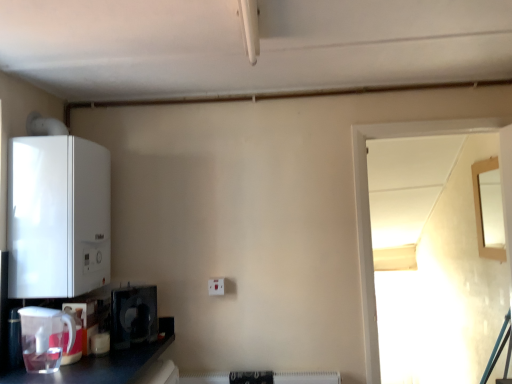
Question: Does white plastic electric outlet at center have a greater height compared to transparent glass door at right, which appears as the second window when viewed from the back?

Choices:
 (A) no
 (B) yes

Answer: (A)

Question: Is white plastic electric outlet at center smaller than transparent glass door at right, which appears as the first window when viewed from the left?

Choices:
 (A) no
 (B) yes

Answer: (B)

Question: Does white plastic electric outlet at center come in front of transparent glass door at right, which appears as the first window when viewed from the left?

Choices:
 (A) yes
 (B) no

Answer: (B)

Question: From the image's perspective, is white plastic electric outlet at center beneath transparent glass door at right, positioned as the 1th window in front-to-back order?

Choices:
 (A) yes
 (B) no

Answer: (A)

Question: Could you tell me if white plastic electric outlet at center is turned towards transparent glass door at right, which appears as the second window when viewed from the back?

Choices:
 (A) no
 (B) yes

Answer: (A)

Question: In the image, is wooden framed mirror at upper right, the 2th window from the left, positioned in front of or behind matte white kettle at lower left, which is the first appliance from bottom to top?

Choices:
 (A) front
 (B) behind

Answer: (B)

Question: Is wooden framed mirror at upper right, the 2th window from the left, situated inside matte white kettle at lower left, the fourth appliance from the top, or outside?

Choices:
 (A) inside
 (B) outside

Answer: (B)

Question: Considering the positions of wooden framed mirror at upper right, the 1th window when ordered from right to left, and matte white kettle at lower left, which is the first appliance from bottom to top, in the image, is wooden framed mirror at upper right, the 1th window when ordered from right to left, bigger or smaller than matte white kettle at lower left, which is the first appliance from bottom to top,?

Choices:
 (A) small
 (B) big

Answer: (B)

Question: From the image's perspective, relative to matte white kettle at lower left, the fourth appliance from the top, is wooden framed mirror at upper right, the 2th window from the left, above or below?

Choices:
 (A) above
 (B) below

Answer: (A)

Question: Considering their positions, is black plastic microwave at lower left, which ranks as the 3th appliance in top-to-bottom order, located in front of or behind transparent glass door at right, which appears as the first window when viewed from the left?

Choices:
 (A) front
 (B) behind

Answer: (A)

Question: Based on their sizes in the image, would you say black plastic microwave at lower left, which ranks as the 3th appliance in top-to-bottom order, is bigger or smaller than transparent glass door at right, which appears as the second window when viewed from the back?

Choices:
 (A) big
 (B) small

Answer: (B)

Question: Choose the correct answer: Is black plastic microwave at lower left, the second appliance in the bottom-to-top sequence, inside transparent glass door at right, positioned as the 1th window in front-to-back order, or outside it?

Choices:
 (A) inside
 (B) outside

Answer: (B)

Question: From the image's perspective, is black plastic microwave at lower left, which ranks as the 3th appliance in top-to-bottom order, located above or below transparent glass door at right, positioned as the 1th window in front-to-back order?

Choices:
 (A) above
 (B) below

Answer: (B)

Question: Looking at their shapes, would you say black plastic microwave at lower left, which ranks as the 3th appliance in top-to-bottom order, is wider or thinner than wooden framed mirror at upper right, the 1th window when ordered from right to left?

Choices:
 (A) thin
 (B) wide

Answer: (B)

Question: Is black plastic microwave at lower left, the second appliance in the bottom-to-top sequence, taller or shorter than wooden framed mirror at upper right, the 1th window when ordered from right to left?

Choices:
 (A) short
 (B) tall

Answer: (A)